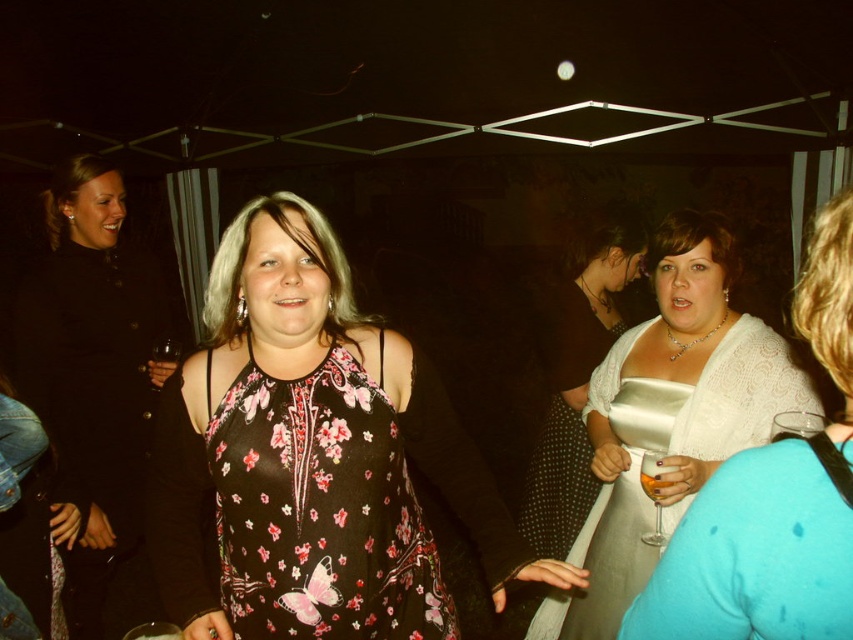
Question: Among these points, which one is farthest from the camera?

Choices:
 (A) (695, 454)
 (B) (76, 605)
 (C) (675, 467)

Answer: (B)

Question: Is floral-patterned fabric dress at center behind satin white dress at center?

Choices:
 (A) yes
 (B) no

Answer: (B)

Question: Among these points, which one is nearest to the camera?

Choices:
 (A) (273, 216)
 (B) (651, 486)
 (C) (665, 353)
 (D) (91, 417)

Answer: (A)

Question: From the image, what is the correct spatial relationship of floral-patterned fabric dress at center in relation to white satin dress at center?

Choices:
 (A) below
 (B) above

Answer: (A)

Question: Is floral-patterned fabric dress at center to the right of matte black dress at left from the viewer's perspective?

Choices:
 (A) yes
 (B) no

Answer: (A)

Question: Estimate the real-world distances between objects in this image. Which object is closer to the floral-patterned fabric dress at center?

Choices:
 (A) translucent glass wine at center
 (B) white satin dress at center
 (C) matte black dress at left
 (D) floral-patterned dress at center

Answer: (D)